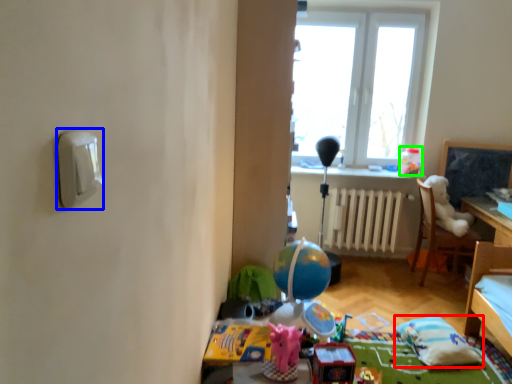
Question: Estimate the real-world distances between objects in this image. Which object is closer to pillow (highlighted by a red box), light switch (highlighted by a blue box) or toy (highlighted by a green box)?

Choices:
 (A) light switch
 (B) toy

Answer: (B)